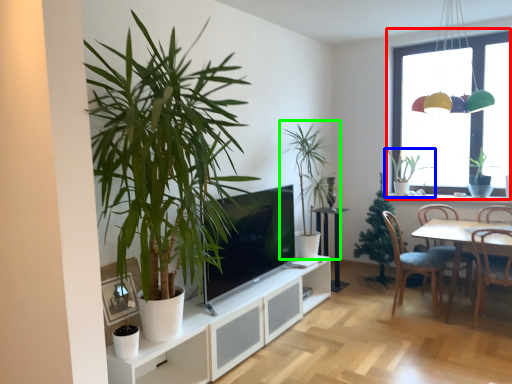
Question: Which object is positioned closest to window (highlighted by a red box)? Select from houseplant (highlighted by a blue box) and houseplant (highlighted by a green box).

Choices:
 (A) houseplant
 (B) houseplant

Answer: (A)